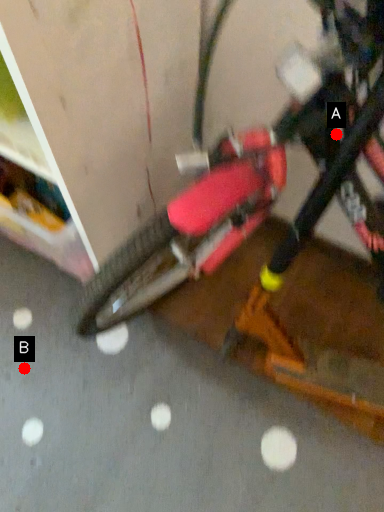
Question: Two points are circled on the image, labeled by A and B beside each circle. Which point is closer to the camera?

Choices:
 (A) A is closer
 (B) B is closer

Answer: (A)